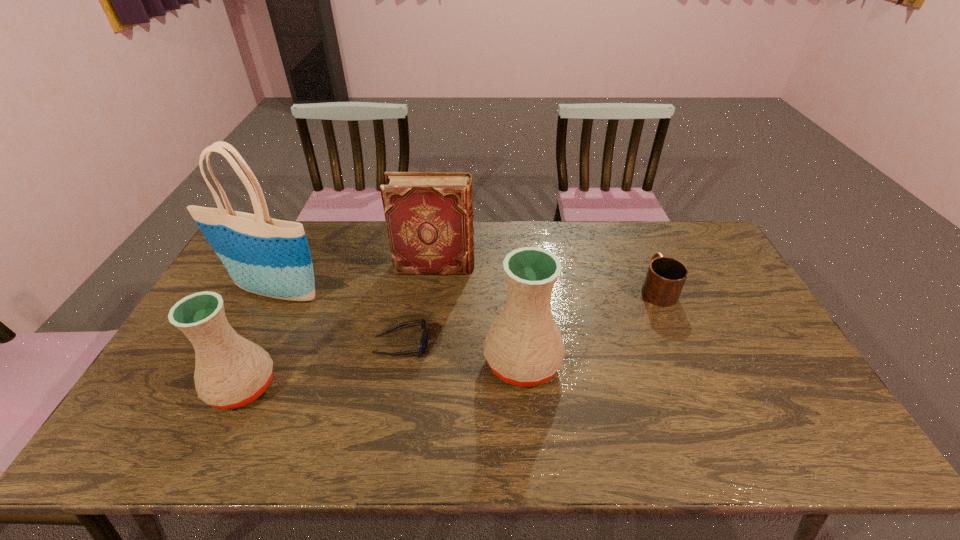
Identify the location of free area in between the hardback book and the tallest object. The height and width of the screenshot is (540, 960). (355, 279).

The height and width of the screenshot is (540, 960). Find the location of `vacant area between the taller pottery and the left pottery`. vacant area between the taller pottery and the left pottery is located at coordinates (382, 374).

Identify the location of free area in between the fifth object from left to right and the second shortest object. The height and width of the screenshot is (540, 960). (589, 325).

Identify which object is the nearest to the second object from right to left. Please provide its 2D coordinates. Your answer should be formatted as a tuple, i.e. [(x, y)], where the tuple contains the x and y coordinates of a point satisfying the conditions above.

[(423, 344)]

Where is `object that is the second nearest to the shorter pottery`? Image resolution: width=960 pixels, height=540 pixels. object that is the second nearest to the shorter pottery is located at coordinates (423, 344).

Find the location of a particular element. This screenshot has height=540, width=960. vacant space that satisfies the following two spatial constraints: 1. on the front side of the left pottery; 2. on the left side of the tallest object is located at coordinates (228, 387).

At what (x,y) coordinates should I click in order to perform the action: click on free location that satisfies the following two spatial constraints: 1. on the front-facing side of the taller pottery; 2. on the right side of the shortest object. Please return your answer as a coordinate pair (x, y). Looking at the image, I should click on (398, 362).

At what (x,y) coordinates should I click in order to perform the action: click on free location that satisfies the following two spatial constraints: 1. on the side of the mug with the handle; 2. on the spine side of the hardback book. Please return your answer as a coordinate pair (x, y). This screenshot has width=960, height=540. Looking at the image, I should click on (647, 267).

Locate an element on the screen. The height and width of the screenshot is (540, 960). vacant position in the image that satisfies the following two spatial constraints: 1. on the side of the rightmost object with the handle; 2. on the spine side of the hardback book is located at coordinates (647, 267).

The height and width of the screenshot is (540, 960). Find the location of `free space in the image that satisfies the following two spatial constraints: 1. on the side of the rightmost object with the handle; 2. on the spine side of the hardback book`. free space in the image that satisfies the following two spatial constraints: 1. on the side of the rightmost object with the handle; 2. on the spine side of the hardback book is located at coordinates click(x=647, y=267).